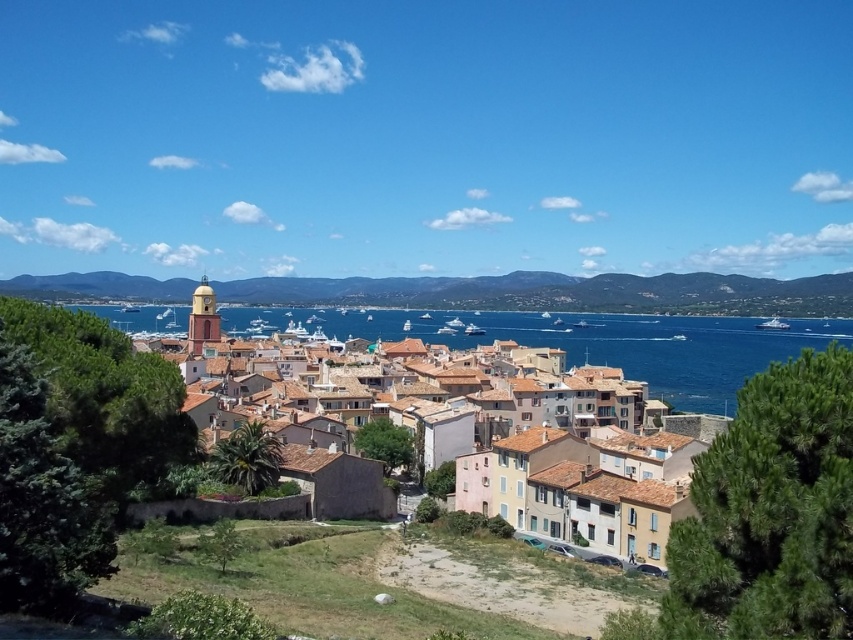
Question: Can you confirm if blue water at center is positioned to the right of metallic silver boat at right?

Choices:
 (A) yes
 (B) no

Answer: (B)

Question: Which point is closer to the camera?

Choices:
 (A) blue water at center
 (B) metallic silver boat at right
 (C) multicolored tiled roofs at center

Answer: (C)

Question: Which object is positioned closest to the multicolored tiled roofs at center?

Choices:
 (A) blue water at center
 (B) green grassy hillside at center

Answer: (A)

Question: Which is farther from the green grassy hillside at center?

Choices:
 (A) blue water at center
 (B) multicolored tiled roofs at center
 (C) metallic silver boat at right

Answer: (B)

Question: Can you confirm if blue water at center is smaller than multicolored tiled roofs at center?

Choices:
 (A) no
 (B) yes

Answer: (A)

Question: Can you confirm if blue water at center is wider than metallic silver boat at right?

Choices:
 (A) no
 (B) yes

Answer: (B)